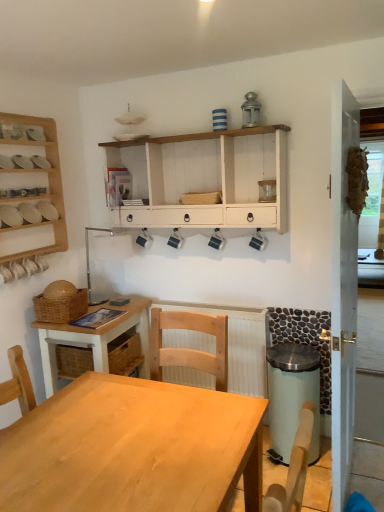
This screenshot has height=512, width=384. Describe the element at coordinates (61, 308) in the screenshot. I see `woven brown basket at left, the 1th basket positioned from the bottom` at that location.

At what (x,y) coordinates should I click in order to perform the action: click on white matte bowls at upper left, the second shelf positioned from the right. Please return your answer as a coordinate pair (x, y). The image size is (384, 512). Looking at the image, I should click on (28, 213).

Consider the image. Measure the distance between light wood table at center and camera.

The distance of light wood table at center from camera is 1.20 meters.

Locate an element on the screen. The height and width of the screenshot is (512, 384). white textured radiator at center is located at coordinates (238, 344).

Describe the element at coordinates (207, 179) in the screenshot. I see `white painted wood shelf at upper center, arranged as the 1th shelf when viewed from the right` at that location.

At what (x,y) coordinates should I click in order to perform the action: click on woven brown basket at left, which appears as the 2th basket when viewed from the top. Please return your answer as a coordinate pair (x, y). The image size is (384, 512). Looking at the image, I should click on (61, 308).

Considering the sizes of objects light green plastic trash bin at lower right and light wood table at center in the image provided, who is shorter, light green plastic trash bin at lower right or light wood table at center?

light green plastic trash bin at lower right is shorter.

Is light green plastic trash bin at lower right thinner than light wood table at center?

Indeed, light green plastic trash bin at lower right has a lesser width compared to light wood table at center.

Between light green plastic trash bin at lower right and light wood table at center, which one has smaller size?

light green plastic trash bin at lower right is smaller.

Does light green plastic trash bin at lower right contain light wood table at center?

No, light wood table at center is located outside of light green plastic trash bin at lower right.

Is point (37, 214) positioned before point (285, 352)?

Yes.

Between white matte bowls at upper left, the second shelf positioned from the right, and light green plastic trash bin at lower right, which one is positioned behind?

Positioned behind is white matte bowls at upper left, the second shelf positioned from the right.

Is white matte bowls at upper left, the 1th shelf viewed from the left, turned away from light green plastic trash bin at lower right?

No.

This screenshot has width=384, height=512. Find the location of `shelf that is the 2nd object located behind the light green plastic trash bin at lower right`. shelf that is the 2nd object located behind the light green plastic trash bin at lower right is located at coordinates (28, 213).

Is woven brown basket at center, the second basket ordered from the bottom, not near white textured radiator at center?

They are positioned close to each other.

Considering the positions of objects woven brown basket at center, placed as the first basket when sorted from top to bottom, and white textured radiator at center in the image provided, who is more to the right, woven brown basket at center, placed as the first basket when sorted from top to bottom, or white textured radiator at center?

white textured radiator at center is more to the right.

How different are the orientations of woven brown basket at center, placed as the first basket when sorted from top to bottom, and white textured radiator at center in degrees?

The angular difference between woven brown basket at center, placed as the first basket when sorted from top to bottom, and white textured radiator at center is 3.45 degrees.

The width and height of the screenshot is (384, 512). Find the location of `radiator that appears below the woven brown basket at center, which is counted as the 1th basket, starting from the right (from a real-world perspective)`. radiator that appears below the woven brown basket at center, which is counted as the 1th basket, starting from the right (from a real-world perspective) is located at coordinates (238, 344).

From the picture: From the image's perspective, which is below, white textured radiator at center or wooden shelf at left?

From the image's view, white textured radiator at center is below.

From a real-world perspective, is white textured radiator at center located beneath wooden shelf at left?

Yes, from a real-world perspective, white textured radiator at center is beneath wooden shelf at left.

Is there a large distance between white textured radiator at center and wooden shelf at left?

Absolutely, white textured radiator at center is distant from wooden shelf at left.

Considering the relative positions of white textured radiator at center and wooden shelf at left in the image provided, is white textured radiator at center behind wooden shelf at left?

Yes, white textured radiator at center is further from the camera.

From the image's perspective, is woven brown basket at center, the second basket ordered from the bottom, above or below wooden screen door at right?

Based on their image positions, woven brown basket at center, the second basket ordered from the bottom, is located above wooden screen door at right.

Between woven brown basket at center, placed as the first basket when sorted from top to bottom, and wooden screen door at right, which one has larger size?

wooden screen door at right is bigger.

Which object is positioned more to the left, woven brown basket at center, which is the 2th basket in left-to-right order, or wooden screen door at right?

Positioned to the left is woven brown basket at center, which is the 2th basket in left-to-right order.

Is woven brown basket at center, which is the 2th basket in left-to-right order, in front of or behind wooden screen door at right in the image?

Clearly, woven brown basket at center, which is the 2th basket in left-to-right order, is behind wooden screen door at right.

Where is `screen door in front of the natural wood desk at left`? screen door in front of the natural wood desk at left is located at coordinates (343, 290).

From the image's perspective, who appears lower, natural wood desk at left or wooden screen door at right?

natural wood desk at left is shown below in the image.

Does natural wood desk at left lie in front of wooden screen door at right?

No, natural wood desk at left is further to the viewer.

Would you say natural wood desk at left contains wooden screen door at right?

Actually, wooden screen door at right is outside natural wood desk at left.

In terms of size, does wooden screen door at right appear bigger or smaller than white textured radiator at center?

In the image, wooden screen door at right appears to be larger than white textured radiator at center.

Measure the distance between wooden screen door at right and white textured radiator at center.

wooden screen door at right is 34.10 inches from white textured radiator at center.

Does point (346, 312) come behind point (199, 334)?

No.

The image size is (384, 512). What are the coordinates of `trash bin/can on the right side of light wood table at center` in the screenshot? It's located at (292, 395).

Find the location of a particular element. Image resolution: width=384 pixels, height=512 pixels. trash bin/can in front of the white matte bowls at upper left, the second shelf positioned from the right is located at coordinates (292, 395).

Which object lies nearer to the anchor point natural wood desk at left, white textured radiator at center or white painted wood shelf at upper center, the 2th shelf from the left?

Among the two, white textured radiator at center is located nearer to natural wood desk at left.

When comparing their distances from white matte bowls at upper left, the second shelf positioned from the right, does natural wood desk at left or white painted wood shelf at upper center, the 2th shelf from the left, seem further?

white painted wood shelf at upper center, the 2th shelf from the left, lies further to white matte bowls at upper left, the second shelf positioned from the right, than the other object.

From the image, which object appears to be nearer to wooden shelf at left, woven brown basket at center, the second basket ordered from the bottom, or white painted wood shelf at upper center, arranged as the 1th shelf when viewed from the right?

white painted wood shelf at upper center, arranged as the 1th shelf when viewed from the right, is positioned closer to the anchor wooden shelf at left.

Considering their positions, is white textured radiator at center positioned closer to white painted wood shelf at upper center, arranged as the 1th shelf when viewed from the right, than natural wood desk at left?

Based on the image, white textured radiator at center appears to be nearer to white painted wood shelf at upper center, arranged as the 1th shelf when viewed from the right.

When comparing their distances from light green plastic trash bin at lower right, does wooden shelf at left or white painted wood shelf at upper center, the 2th shelf from the left, seem further?

Based on the image, wooden shelf at left appears to be further to light green plastic trash bin at lower right.

Which object lies nearer to the anchor point wooden screen door at right, light wood table at center or natural wood desk at left?

Among the two, light wood table at center is located nearer to wooden screen door at right.

From the image, which object appears to be farther from woven brown basket at center, which is counted as the 1th basket, starting from the right, white painted wood shelf at upper center, arranged as the 1th shelf when viewed from the right, or white textured radiator at center?

white textured radiator at center is further to woven brown basket at center, which is counted as the 1th basket, starting from the right.

Estimate the real-world distances between objects in this image. Which object is closer to light wood table at center, white textured radiator at center or wooden screen door at right?

wooden screen door at right.

Where is `desk between woven brown basket at left, which appears as the 2th basket when viewed from the top, and white textured radiator at center from left to right`? This screenshot has height=512, width=384. desk between woven brown basket at left, which appears as the 2th basket when viewed from the top, and white textured radiator at center from left to right is located at coordinates (94, 340).

Locate an element on the screen. This screenshot has width=384, height=512. shelf between wooden shelf at left and woven brown basket at left, the 1th basket positioned from the bottom, in the up-down direction is located at coordinates (28, 213).

You are a GUI agent. You are given a task and a screenshot of the screen. Output one action in this format:
    pyautogui.click(x=<x>, y=<y>)
    Task: Click on the desk that lies between woven brown basket at center, placed as the first basket when sorted from top to bottom, and light green plastic trash bin at lower right from top to bottom
    The image size is (384, 512).
    Given the screenshot: What is the action you would take?
    pyautogui.click(x=94, y=340)

You are a GUI agent. You are given a task and a screenshot of the screen. Output one action in this format:
    pyautogui.click(x=<x>, y=<y>)
    Task: Click on the table between wooden shelf at left and wooden screen door at right
    
    Given the screenshot: What is the action you would take?
    pyautogui.click(x=133, y=449)